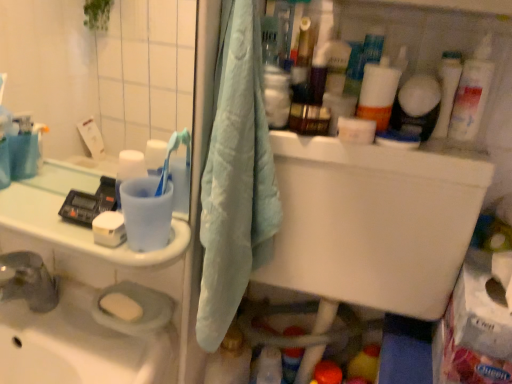
Where is `vacant space in front of white plastic tube at upper right`? The width and height of the screenshot is (512, 384). vacant space in front of white plastic tube at upper right is located at coordinates (445, 156).